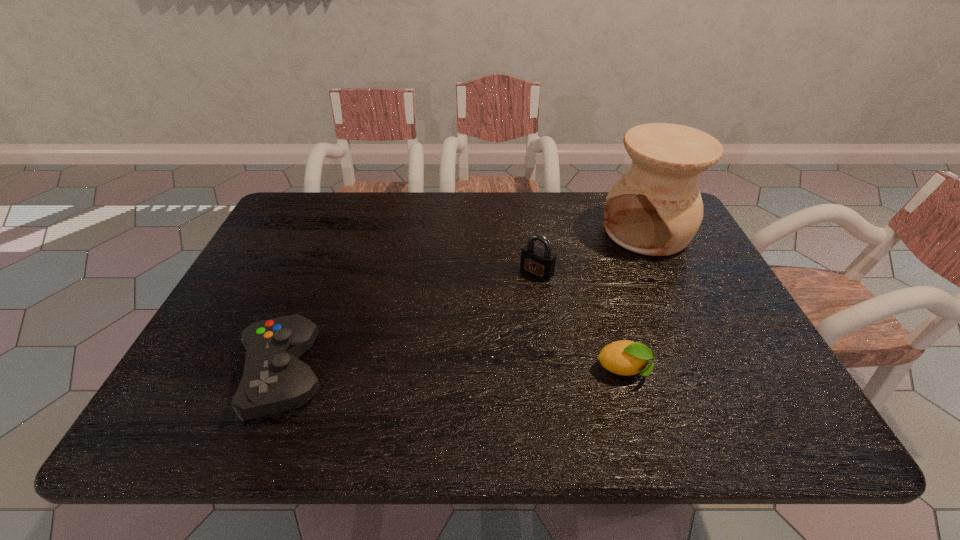
At what (x,y) coordinates should I click in order to perform the action: click on object at the far right corner. Please return your answer as a coordinate pair (x, y). Looking at the image, I should click on (655, 208).

Locate an element on the screen. vacant area at the far edge of the desktop is located at coordinates (390, 199).

Find the location of a particular element. This screenshot has height=540, width=960. free region at the near edge of the desktop is located at coordinates (484, 395).

Where is `free region at the left edge`? This screenshot has width=960, height=540. free region at the left edge is located at coordinates (199, 347).

At what (x,y) coordinates should I click in order to perform the action: click on free space at the right edge. Please return your answer as a coordinate pair (x, y). The width and height of the screenshot is (960, 540). Looking at the image, I should click on (709, 328).

This screenshot has width=960, height=540. I want to click on blank space at the far left corner of the desktop, so click(x=300, y=202).

Identify the location of vacant space at the near right corner of the desktop. (751, 395).

Locate an element on the screen. This screenshot has width=960, height=540. unoccupied area between the farthest object and the lemon is located at coordinates (636, 301).

Find the location of a particular element. free space between the tallest object and the leftmost object is located at coordinates [x=465, y=303].

Where is `free space between the control and the lemon`? free space between the control and the lemon is located at coordinates (454, 373).